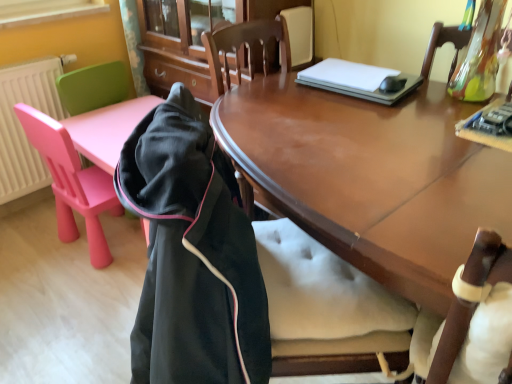
Question: Is black fleece jacket at left positioned with its back to white plastic radiator at left?

Choices:
 (A) yes
 (B) no

Answer: (B)

Question: Can you confirm if black fleece jacket at left is positioned to the left of white plastic radiator at left?

Choices:
 (A) yes
 (B) no

Answer: (B)

Question: Considering the relative sizes of black fleece jacket at left and white plastic radiator at left in the image provided, is black fleece jacket at left wider than white plastic radiator at left?

Choices:
 (A) no
 (B) yes

Answer: (B)

Question: From a real-world perspective, is black fleece jacket at left physically above white plastic radiator at left?

Choices:
 (A) no
 (B) yes

Answer: (B)

Question: From the image's perspective, does black fleece jacket at left appear lower than white plastic radiator at left?

Choices:
 (A) no
 (B) yes

Answer: (B)

Question: Based on their sizes in the image, would you say white plastic radiator at left is bigger or smaller than pink plastic chair at left, placed as the 1th chair when sorted from front to back?

Choices:
 (A) small
 (B) big

Answer: (A)

Question: Is white plastic radiator at left taller or shorter than pink plastic chair at left, the 2th chair when ordered from back to front?

Choices:
 (A) tall
 (B) short

Answer: (B)

Question: From a real-world perspective, is white plastic radiator at left physically located above or below pink plastic chair at left, placed as the 1th chair when sorted from front to back?

Choices:
 (A) above
 (B) below

Answer: (A)

Question: Is white plastic radiator at left inside or outside of pink plastic chair at left, placed as the 1th chair when sorted from front to back?

Choices:
 (A) inside
 (B) outside

Answer: (B)

Question: Looking at the image, does pink plastic chair at left, placed as the 1th chair when sorted from front to back, seem bigger or smaller compared to shiny brown wood desk at center?

Choices:
 (A) big
 (B) small

Answer: (B)

Question: Is point (49, 170) closer or farther from the camera than point (331, 192)?

Choices:
 (A) farther
 (B) closer

Answer: (A)

Question: Relative to shiny brown wood desk at center, is pink plastic chair at left, the 2th chair when ordered from back to front, in front or behind?

Choices:
 (A) behind
 (B) front

Answer: (A)

Question: Considering the positions of pink plastic chair at left, the 2th chair when ordered from back to front, and shiny brown wood desk at center in the image, is pink plastic chair at left, the 2th chair when ordered from back to front, taller or shorter than shiny brown wood desk at center?

Choices:
 (A) short
 (B) tall

Answer: (A)

Question: From a real-world perspective, is black fleece jacket at left above or below shiny brown wood desk at center?

Choices:
 (A) below
 (B) above

Answer: (B)

Question: Is black fleece jacket at left spatially inside shiny brown wood desk at center, or outside of it?

Choices:
 (A) outside
 (B) inside

Answer: (A)